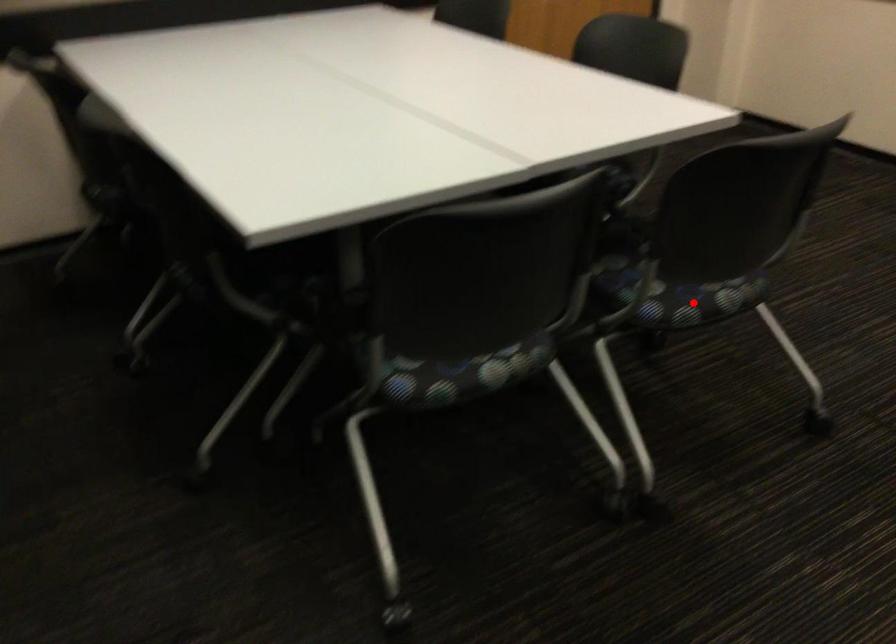
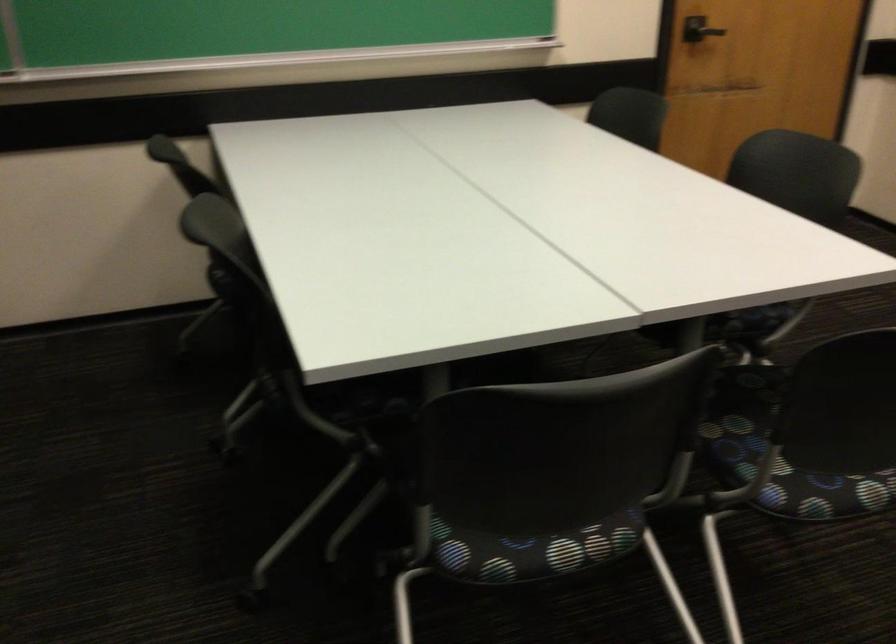
Question: I am providing you with two images of the same scene from different viewpoints. Given a red point in image1, look at the same physical point in image2. Is it:

Choices:
 (A) Closer to the viewpoint
 (B) Farther from the viewpoint

Answer: (A)